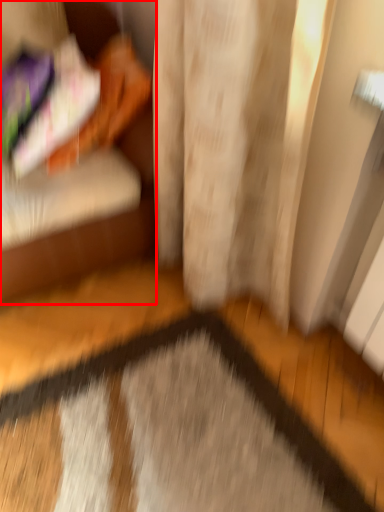
Question: In this image, where is furniture (annotated by the red box) located relative to doormat?

Choices:
 (A) right
 (B) left

Answer: (B)